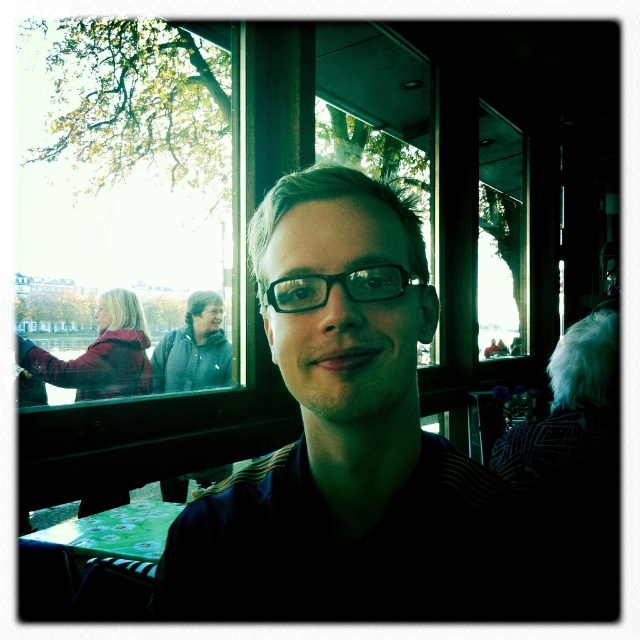
Question: Is matte black shirt at center bigger than black plastic glasses at center?

Choices:
 (A) no
 (B) yes

Answer: (B)

Question: Which point is closer to the camera?

Choices:
 (A) (369, 588)
 (B) (385, 285)

Answer: (B)

Question: Can you confirm if matte black shirt at center is positioned above black plastic glasses at center?

Choices:
 (A) yes
 (B) no

Answer: (B)

Question: Which object appears farthest from the camera in this image?

Choices:
 (A) black plastic glasses at center
 (B) matte black shirt at center

Answer: (A)

Question: Does matte black shirt at center lie behind black plastic glasses at center?

Choices:
 (A) no
 (B) yes

Answer: (A)

Question: Which object appears closest to the camera in this image?

Choices:
 (A) black plastic glasses at center
 (B) matte black shirt at center

Answer: (B)